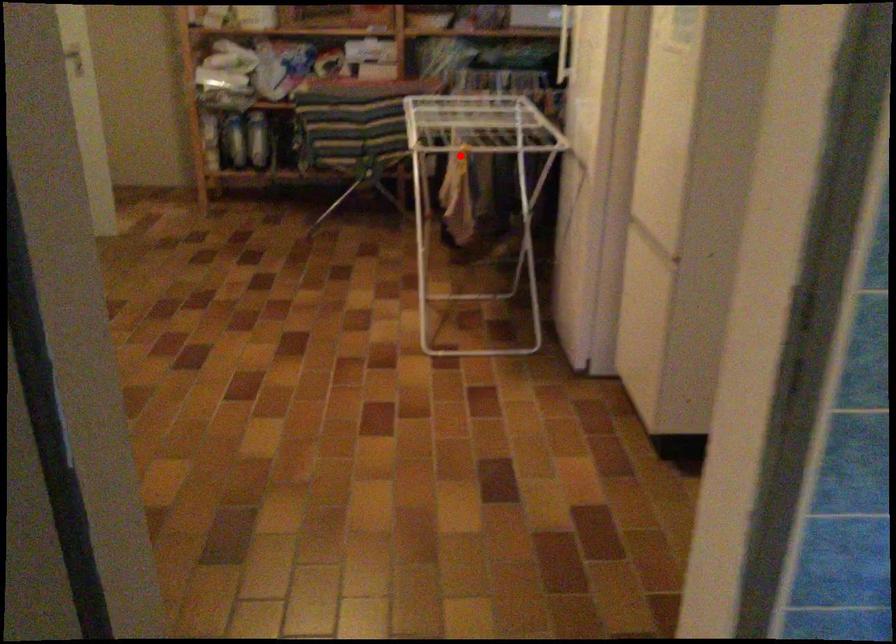
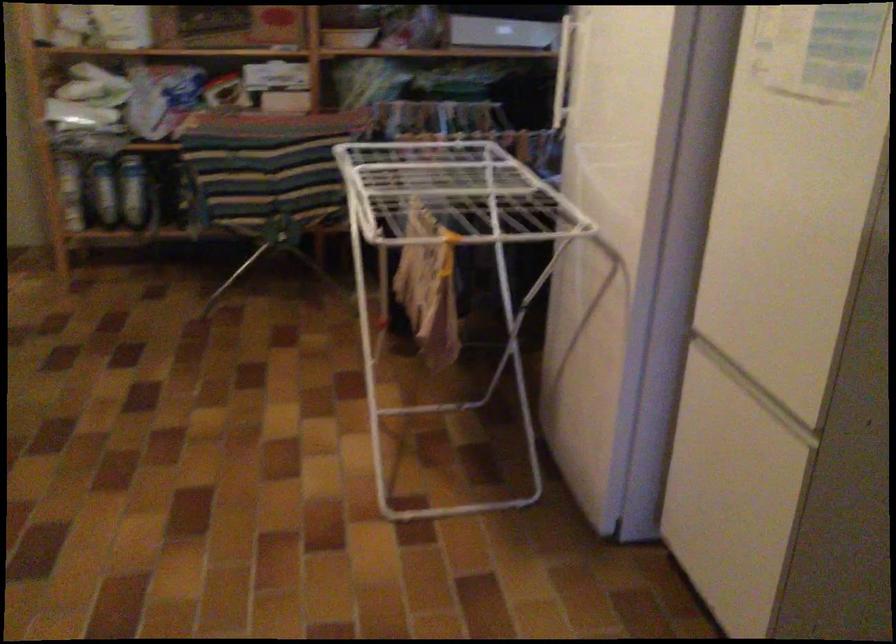
Question: I am providing you with two images of the same scene from different viewpoints. Image1 has a red point marked. In image2, the corresponding 3D location appears at what relative position? Reply with the corresponding letter.

Choices:
 (A) Closer
 (B) Farther

Answer: (A)